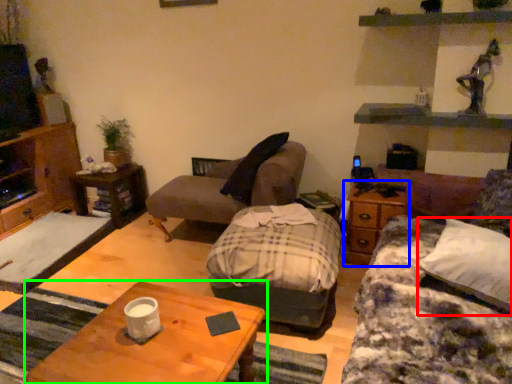
Question: Which object is the closest to the pillow (highlighted by a red box)? Choose among these: side table (highlighted by a blue box) or coffee table (highlighted by a green box).

Choices:
 (A) side table
 (B) coffee table

Answer: (A)